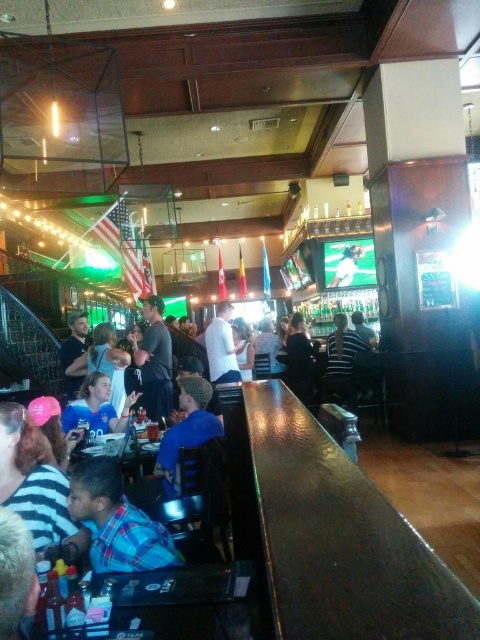
You are a customer sitting at the wooden table at lower center and want to grab a drink from the bar. Can you reach the bar without moving past the striped fabric shirt at lower left?

The wooden table at lower center is closer to the viewer than the striped fabric shirt at lower left, so you can reach the bar without moving past the striped fabric shirt at lower left.

You are a bartender who needs to place a new drink menu on the bar. Considering the sizes of the shiny brown wood bar at center and the striped fabric shirt at lower left, which object do you think has enough space to place the menu without overlapping anything?

The shiny brown wood bar at center has a larger size compared to striped fabric shirt at lower left, so the shiny brown wood bar at center has enough space to place the menu without overlapping anything.

You are a server carrying a tray of drinks. You need to move from the kitchen entrance to the wooden table at lower center and then to the striped fabric shirt at lower left. Given that the distance between these two locations is 25.06 inches, do you think you can navigate this path without spilling any drinks?

The wooden table at lower center is 25.06 inches away from the striped fabric shirt at lower left. Since this distance is relatively short, the server should be able to navigate the path carefully without spilling drinks, provided they move steadily and avoid sudden movements.